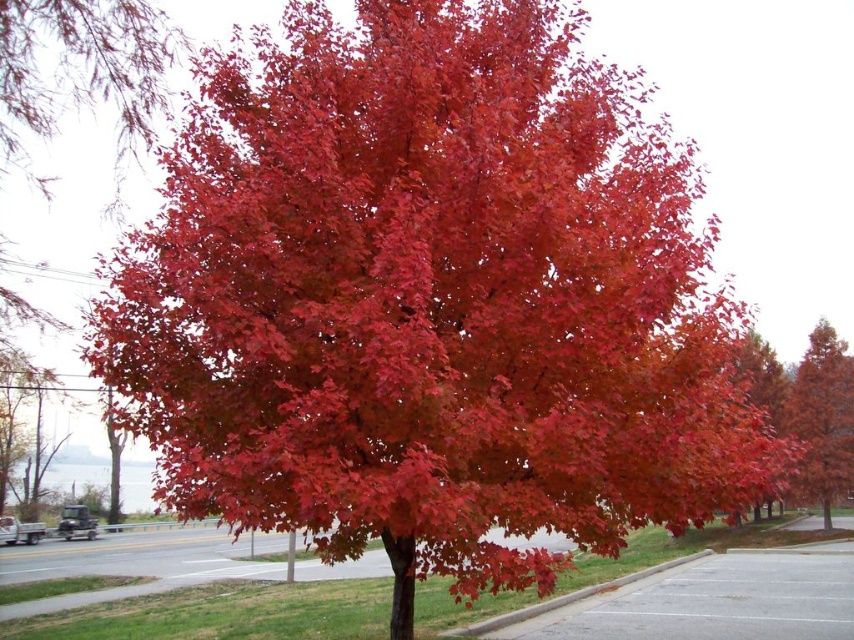
You are a gardener standing at the edge of the sidewalk. You need to plant a new tree that requires 10 meters of space above it. Looking at the glossy red maple at center and the gray asphalt curb at lower right, which object will allow enough vertical space for the new tree?

The glossy red maple at center is much taller than the gray asphalt curb at lower right, so the area near the glossy red maple at center may not have enough vertical space for the new tree. The gray asphalt curb at lower right is shorter, so planting the tree there might provide sufficient vertical clearance.

You are a gardener trying to plant a new tree in your backyard. You have a space that can accommodate a tree up to the size of the gray asphalt curb at lower right. Based on the image, can the glossy red maple at center grow within this space?

The glossy red maple at center is larger than the gray asphalt curb at lower right, so it cannot grow within the space allocated for the gray asphalt curb at lower right.

You are a photographer standing at a certain distance from the glossy red maple at center. You want to capture a photo where the tree fills the frame without cropping any part of it. Given that your camera has a standard lens with a focal length of 50mm, and knowing the tree is 10 meters tall, can you determine if you are within the ideal shooting distance?

The glossy red maple at center is 26.21 meters away from the camera. Using the lens formula, the ideal distance for a 10m tall tree with a 50mm lens is approximately 26.21 meters, so you are at the ideal distance.